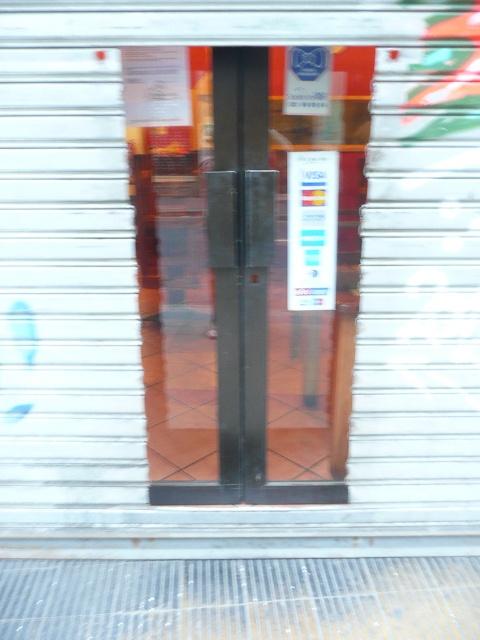
Who is higher up, transparent glass door at center or white paper at center?

white paper at center

Is transparent glass door at center below white paper at center?

Correct, transparent glass door at center is located below white paper at center.

Is point (180, 280) behind point (324, 196)?

Yes, point (180, 280) is farther from viewer.

Find the location of a particular element. transparent glass door at center is located at coordinates (255, 280).